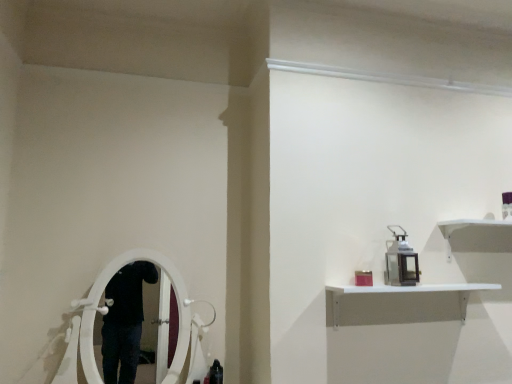
Question: In the image, is metal lantern at upper right positioned in front of or behind white matte shelf at upper right?

Choices:
 (A) front
 (B) behind

Answer: (B)

Question: From the image's perspective, is metal lantern at upper right positioned above or below white matte shelf at upper right?

Choices:
 (A) above
 (B) below

Answer: (A)

Question: Visually, is metal lantern at upper right positioned to the left or to the right of white matte shelf at upper right?

Choices:
 (A) left
 (B) right

Answer: (A)

Question: Is point (424, 284) closer or farther from the camera than point (392, 253)?

Choices:
 (A) closer
 (B) farther

Answer: (A)

Question: Relative to metal lantern at upper right, is white matte shelf at upper right in front or behind?

Choices:
 (A) front
 (B) behind

Answer: (A)

Question: Is white matte shelf at upper right inside the boundaries of metal lantern at upper right, or outside?

Choices:
 (A) outside
 (B) inside

Answer: (A)

Question: Is white matte shelf at upper right bigger or smaller than metal lantern at upper right?

Choices:
 (A) small
 (B) big

Answer: (B)